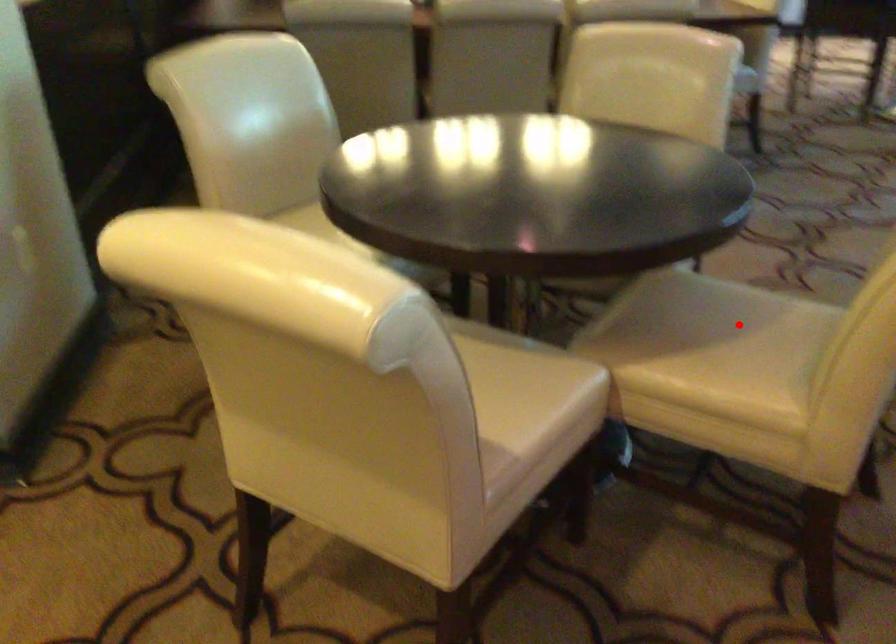
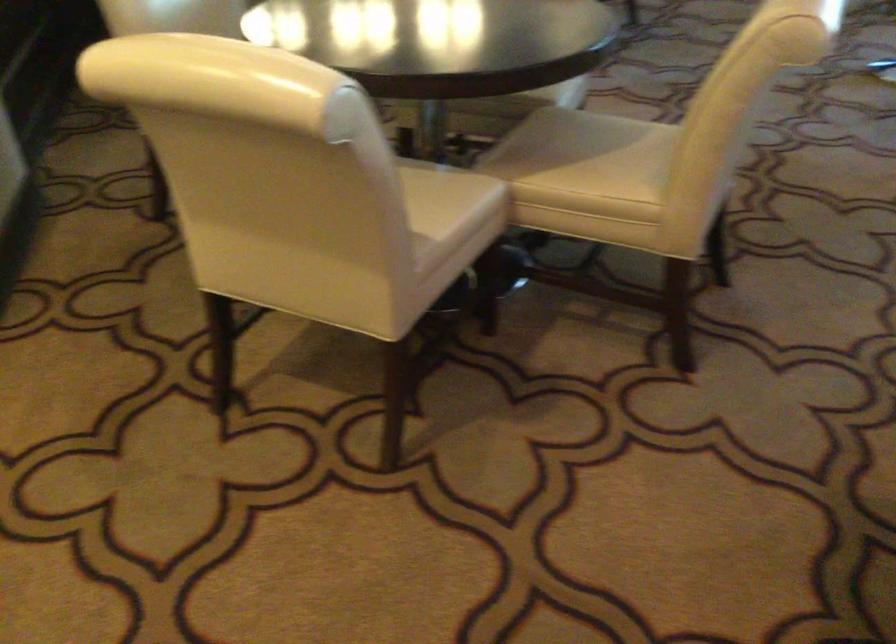
Question: I am providing you with two images of the same scene from different viewpoints. Image1 has a red point marked. In image2, the corresponding 3D location appears at what relative position? Reply with the corresponding letter.

Choices:
 (A) Closer
 (B) Farther

Answer: (B)